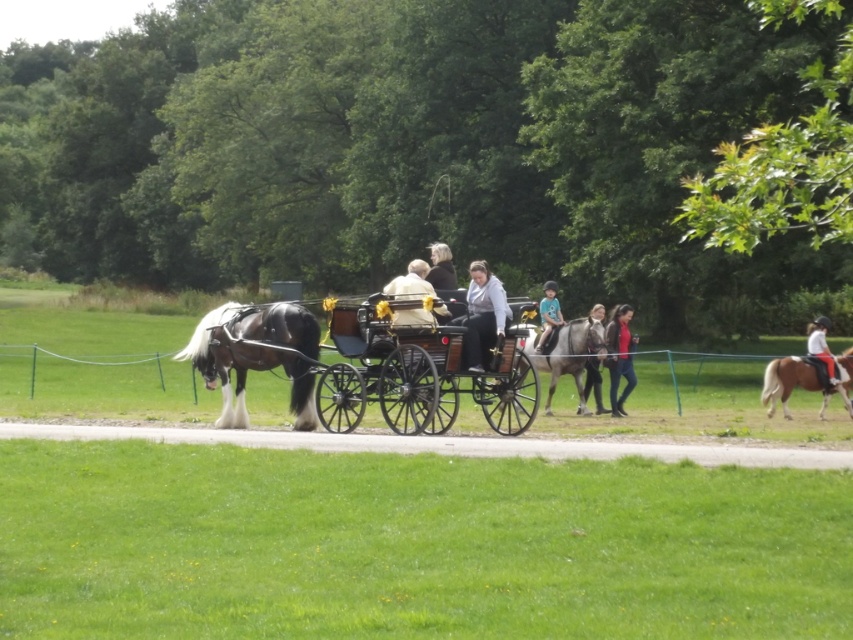
Question: Which object is closer to the camera taking this photo?

Choices:
 (A) dark brown leather jacket at center
 (B) brown glossy horse at right
 (C) matte red shirt at center

Answer: (A)

Question: Which point is farther to the camera?

Choices:
 (A) dark brown leather jacket at center
 (B) teal jersey at center
 (C) light beige fabric at center

Answer: (B)

Question: Which object is the farthest from the matte red shirt at center?

Choices:
 (A) dark brown leather jacket at center
 (B) brown glossy horse at right

Answer: (A)

Question: Does shiny polished wood horse cart at center have a lesser width compared to matte red shirt at center?

Choices:
 (A) no
 (B) yes

Answer: (A)

Question: Is shiny polished wood horse cart at center to the right of brown glossy horse at right from the viewer's perspective?

Choices:
 (A) no
 (B) yes

Answer: (A)

Question: Does shiny polished wood horse cart at center appear on the left side of white leather jacket at right?

Choices:
 (A) yes
 (B) no

Answer: (A)